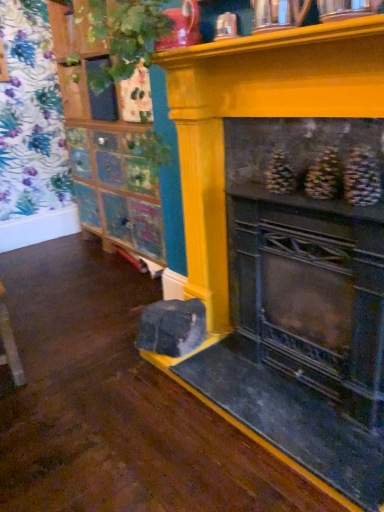
Question: From a real-world perspective, is green leafy plant at upper left positioned under multicolored painted cabinet at left, which is the 2th shelf from front to back, based on gravity?

Choices:
 (A) no
 (B) yes

Answer: (A)

Question: Considering the relative positions of green leafy plant at upper left and multicolored painted cabinet at left, which is the 1th shelf from back to front, in the image provided, is green leafy plant at upper left in front of multicolored painted cabinet at left, which is the 1th shelf from back to front,?

Choices:
 (A) no
 (B) yes

Answer: (B)

Question: Does green leafy plant at upper left have a lesser width compared to multicolored painted cabinet at left, the first shelf viewed from the left?

Choices:
 (A) yes
 (B) no

Answer: (B)

Question: Considering the relative sizes of green leafy plant at upper left and multicolored painted cabinet at left, the 2th shelf from the right, in the image provided, is green leafy plant at upper left smaller than multicolored painted cabinet at left, the 2th shelf from the right,?

Choices:
 (A) yes
 (B) no

Answer: (B)

Question: From the image's perspective, is green leafy plant at upper left above multicolored painted cabinet at left, the first shelf viewed from the left?

Choices:
 (A) no
 (B) yes

Answer: (B)

Question: Does point (148, 44) appear closer or farther from the camera than point (52, 16)?

Choices:
 (A) farther
 (B) closer

Answer: (A)

Question: Is green leafy plant at upper left spatially inside wooden cabinet at upper left, the second shelf when ordered from back to front, or outside of it?

Choices:
 (A) outside
 (B) inside

Answer: (A)

Question: Considering the positions of green leafy plant at upper left and wooden cabinet at upper left, the second shelf when ordered from back to front, in the image, is green leafy plant at upper left taller or shorter than wooden cabinet at upper left, the second shelf when ordered from back to front,?

Choices:
 (A) tall
 (B) short

Answer: (A)

Question: From the image's perspective, is green leafy plant at upper left positioned above or below wooden cabinet at upper left, the second shelf when ordered from back to front?

Choices:
 (A) below
 (B) above

Answer: (B)

Question: Is multicolored painted cabinet at left, which is the 2th shelf from front to back, to the left or to the right of wooden cabinet at upper left, the 1th shelf from the right, in the image?

Choices:
 (A) right
 (B) left

Answer: (B)

Question: In terms of size, does multicolored painted cabinet at left, which is the 2th shelf from front to back, appear bigger or smaller than wooden cabinet at upper left, the first shelf when ordered from front to back?

Choices:
 (A) big
 (B) small

Answer: (A)

Question: In terms of width, does multicolored painted cabinet at left, which is the 1th shelf from back to front, look wider or thinner when compared to wooden cabinet at upper left, the first shelf when ordered from front to back?

Choices:
 (A) thin
 (B) wide

Answer: (A)

Question: Considering the positions of multicolored painted cabinet at left, the first shelf viewed from the left, and wooden cabinet at upper left, the 1th shelf from the right, in the image, is multicolored painted cabinet at left, the first shelf viewed from the left, taller or shorter than wooden cabinet at upper left, the 1th shelf from the right,?

Choices:
 (A) short
 (B) tall

Answer: (B)

Question: Considering the positions of yellow painted wood fireplace at center and multicolored painted cabinet at left, which is the 2th shelf from front to back, in the image, is yellow painted wood fireplace at center taller or shorter than multicolored painted cabinet at left, which is the 2th shelf from front to back,?

Choices:
 (A) tall
 (B) short

Answer: (A)

Question: Considering their positions, is yellow painted wood fireplace at center located in front of or behind multicolored painted cabinet at left, which is the 2th shelf from front to back?

Choices:
 (A) front
 (B) behind

Answer: (A)